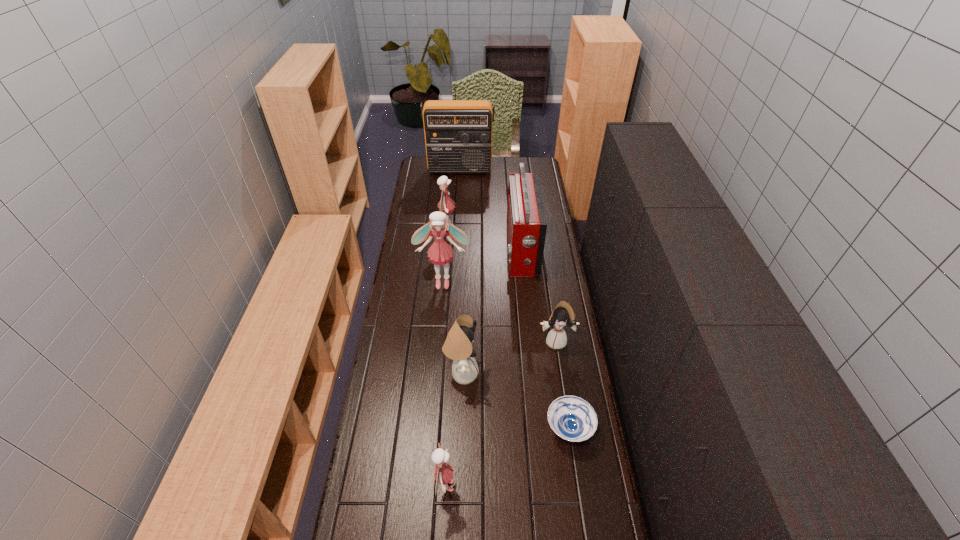
You are a GUI agent. You are given a task and a screenshot of the screen. Output one action in this format:
    pyautogui.click(x=<x>, y=<y>)
    Task: Click on the second closest object to the nearer radio receiver
    Image resolution: width=960 pixels, height=540 pixels.
    Given the screenshot: What is the action you would take?
    pyautogui.click(x=445, y=205)

Where is `object that is the fourth closest to the second biggest pink doll`? This screenshot has height=540, width=960. object that is the fourth closest to the second biggest pink doll is located at coordinates (458, 346).

Select which doll is the fourth closest to the left radio receiver. Please provide its 2D coordinates. Your answer should be formatted as a tuple, i.e. [(x, y)], where the tuple contains the x and y coordinates of a point satisfying the conditions above.

[(458, 346)]

The height and width of the screenshot is (540, 960). In order to click on doll object that ranks as the fourth closest to the fourth nearest doll in this screenshot , I will do `click(443, 473)`.

Find the location of a particular element. The image size is (960, 540). pink doll that is the second closest one to the right radio receiver is located at coordinates (445, 205).

Identify the location of pink doll that is the nearest to the left radio receiver. The height and width of the screenshot is (540, 960). (445, 205).

Locate an element on the screen. The image size is (960, 540). vacant region that satisfies the following two spatial constraints: 1. at the front face of the rightmost doll; 2. at the front face of the bigger black doll is located at coordinates (561, 373).

Locate an element on the screen. The width and height of the screenshot is (960, 540). vacant region that satisfies the following two spatial constraints: 1. at the front face of the soup bowl; 2. on the right side of the rightmost doll is located at coordinates (569, 428).

Identify the location of vacant position in the image that satisfies the following two spatial constraints: 1. on the front-facing side of the soup bowl; 2. on the right side of the second smallest pink doll. (431, 428).